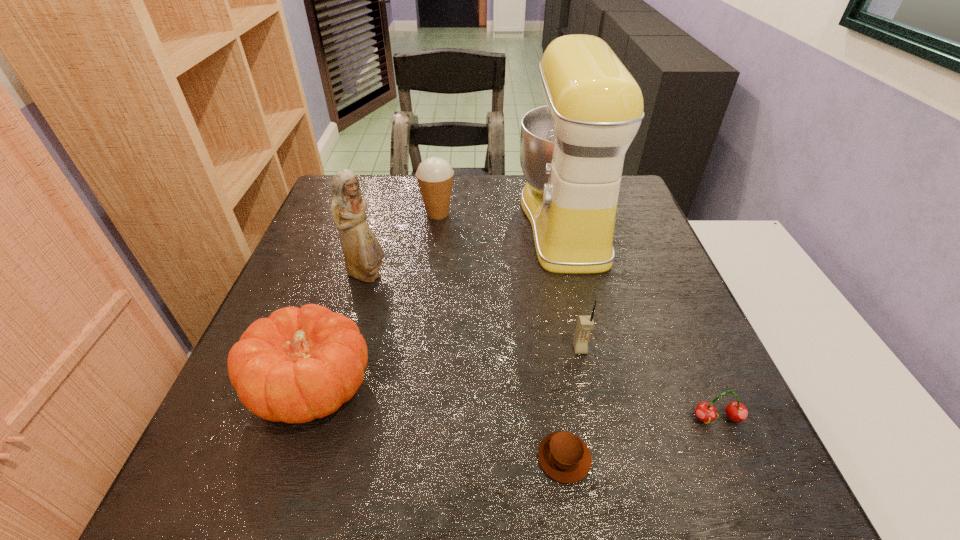
At what (x,y) coordinates should I click in order to perform the action: click on figurine positioned at the left edge. Please return your answer as a coordinate pair (x, y). The height and width of the screenshot is (540, 960). Looking at the image, I should click on (363, 254).

At what (x,y) coordinates should I click in order to perform the action: click on pumpkin positioned at the left edge. Please return your answer as a coordinate pair (x, y). The width and height of the screenshot is (960, 540). Looking at the image, I should click on (297, 365).

You are a GUI agent. You are given a task and a screenshot of the screen. Output one action in this format:
    pyautogui.click(x=<x>, y=<y>)
    Task: Click on the mixer that is positioned at the right edge
    The height and width of the screenshot is (540, 960).
    Given the screenshot: What is the action you would take?
    pyautogui.click(x=572, y=151)

Image resolution: width=960 pixels, height=540 pixels. Identify the location of cherry positioned at the right edge. (736, 411).

The height and width of the screenshot is (540, 960). What are the coordinates of `object situated at the far right corner` in the screenshot? It's located at (572, 151).

Locate an element on the screen. vacant area at the far edge is located at coordinates (470, 219).

Locate an element on the screen. The height and width of the screenshot is (540, 960). vacant space at the near edge of the desktop is located at coordinates (392, 454).

The image size is (960, 540). In the image, there is a desktop. In order to click on free space at the right edge in this screenshot , I will do pos(630,240).

This screenshot has height=540, width=960. Identify the location of free space between the mixer and the pumpkin. [x=439, y=305].

The image size is (960, 540). In order to click on free spot between the second shortest object and the pumpkin in this screenshot , I will do `click(516, 403)`.